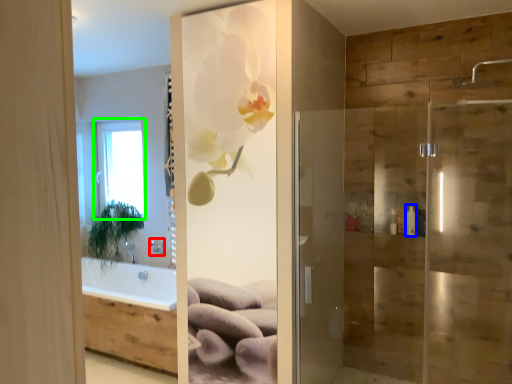
Question: Which object is positioned closest to shower (highlighted by a red box)? Select from toiletry (highlighted by a blue box) and window (highlighted by a green box).

Choices:
 (A) toiletry
 (B) window

Answer: (B)